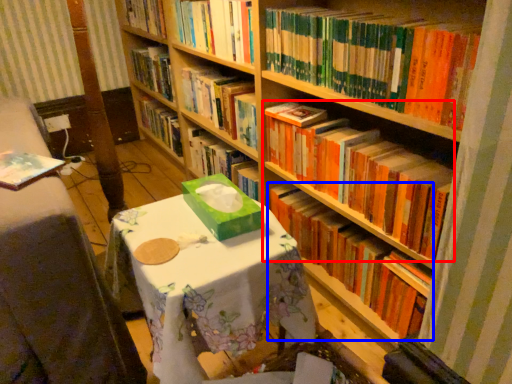
Question: Which point is closer to the camera, book (highlighted by a red box) or book (highlighted by a blue box)?

Choices:
 (A) book
 (B) book

Answer: (A)